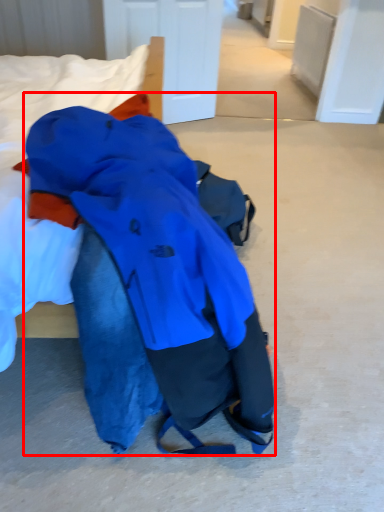
Question: From the image's perspective, where is jacket (annotated by the red box) located in relation to bed in the image?

Choices:
 (A) below
 (B) above

Answer: (A)